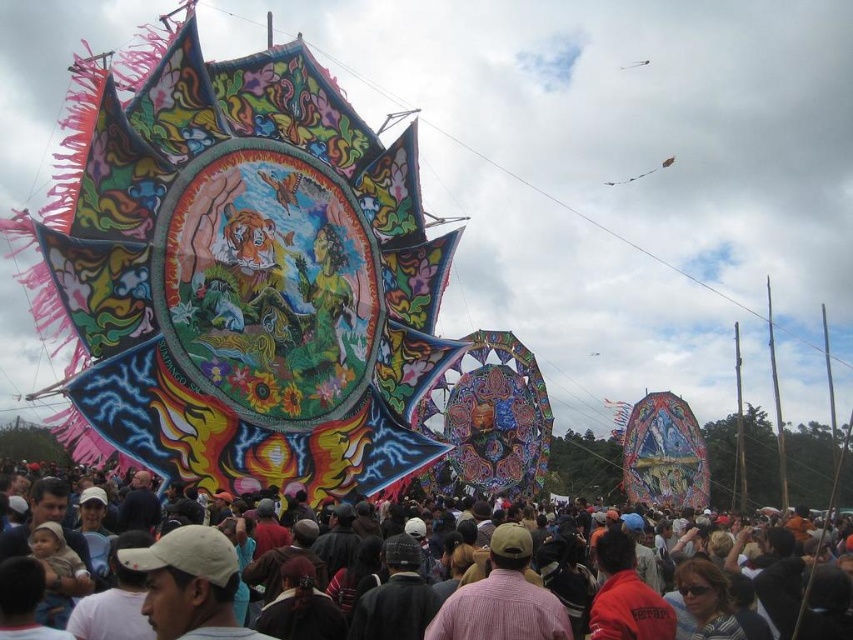
Question: Which of the following is the farthest from the observer?

Choices:
 (A) transparent plastic kite at upper center
 (B) matte black crowd at center
 (C) pink woven shirt at center
 (D) translucent plastic kite at upper center

Answer: (A)

Question: Is translucent plastic kite at upper center wider than transparent plastic kite at upper center?

Choices:
 (A) yes
 (B) no

Answer: (A)

Question: Estimate the real-world distances between objects in this image. Which object is closer to the translucent plastic kite at upper center?

Choices:
 (A) pink woven shirt at center
 (B) matte black crowd at center
 (C) transparent plastic kite at upper center

Answer: (C)

Question: Observing the image, what is the correct spatial positioning of pink woven shirt at center in reference to transparent plastic kite at upper center?

Choices:
 (A) right
 (B) left

Answer: (B)

Question: Which of the following is the closest to the observer?

Choices:
 (A) (459, 596)
 (B) (612, 186)

Answer: (A)

Question: Is matte black crowd at center further to camera compared to pink woven shirt at center?

Choices:
 (A) yes
 (B) no

Answer: (B)